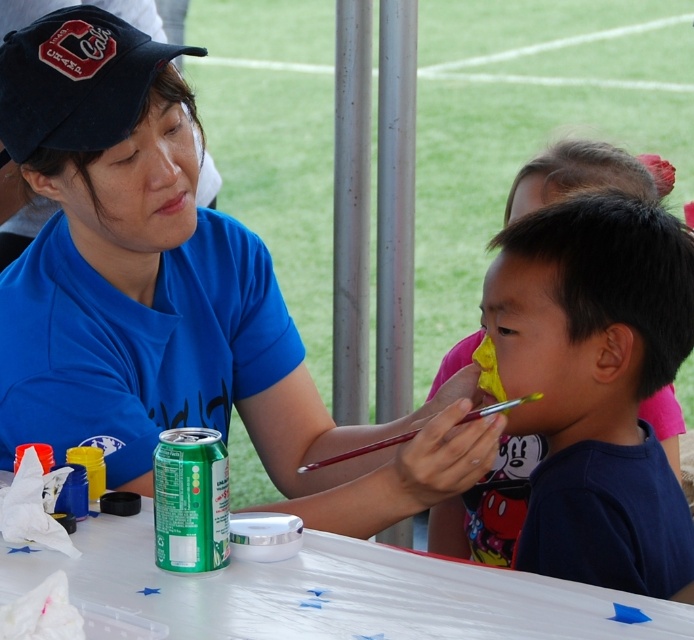
Which is in front, point (174, 52) or point (212, 516)?

Point (212, 516) is more forward.

Is point (44, 68) more distant than point (186, 465)?

Yes, point (44, 68) is behind point (186, 465).

Does point (158, 52) lie behind point (180, 506)?

Yes.

Locate an element on the screen. The height and width of the screenshot is (640, 694). black fabric cap at upper left is located at coordinates (76, 81).

Does blue fabric shirt at upper left lie behind dark blue fabric shirt at right?

Yes, blue fabric shirt at upper left is behind dark blue fabric shirt at right.

Who is taller, blue fabric shirt at upper left or dark blue fabric shirt at right?

blue fabric shirt at upper left is taller.

Who is more forward, (28, 77) or (532, 378)?

Point (532, 378)

This screenshot has height=640, width=694. I want to click on blue fabric shirt at upper left, so click(x=174, y=296).

Which is above, blue fabric shirt at upper left or green matte can at lower left?

blue fabric shirt at upper left is higher up.

Based on the photo, who is more distant from viewer, (65,280) or (178,536)?

The point (65,280) is more distant.

Where is `blue fabric shirt at upper left`? This screenshot has width=694, height=640. blue fabric shirt at upper left is located at coordinates (174, 296).